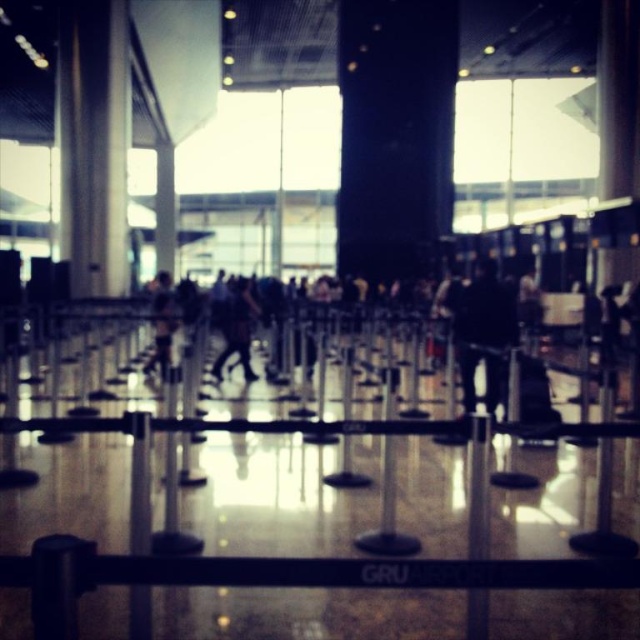
Is dark gray fabric bag at center shorter than dark blue jeans at center?

Yes, dark gray fabric bag at center is shorter than dark blue jeans at center.

Can you confirm if dark gray fabric bag at center is bigger than dark blue jeans at center?

No, dark gray fabric bag at center is not bigger than dark blue jeans at center.

Identify the location of dark gray fabric bag at center. This screenshot has height=640, width=640. (237, 330).